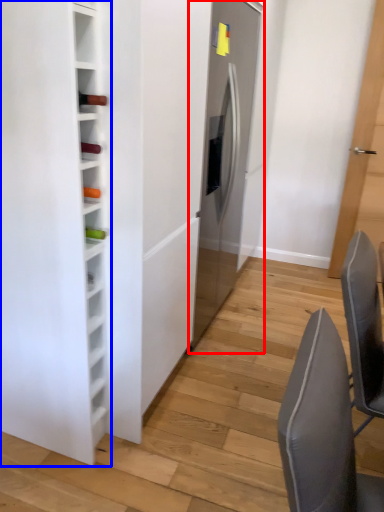
Question: Which of the following is the farthest to the observer, fridge (highlighted by a red box) or furniture (highlighted by a blue box)?

Choices:
 (A) fridge
 (B) furniture

Answer: (A)